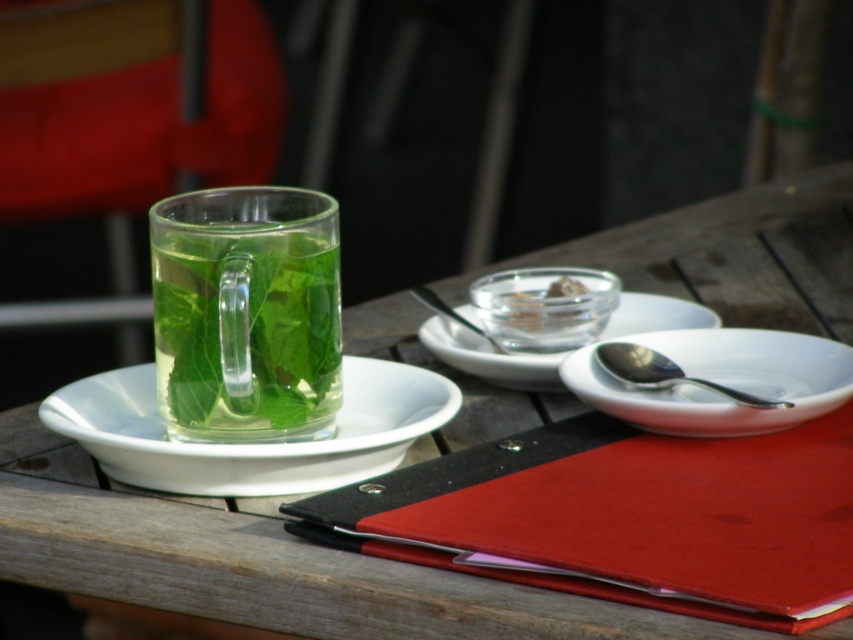
Question: Is transparent glass cup at upper left wider than silver metallic spoon at upper right?

Choices:
 (A) no
 (B) yes

Answer: (B)

Question: Which point is closer to the camera taking this photo?

Choices:
 (A) (x=560, y=246)
 (B) (x=581, y=284)

Answer: (B)

Question: Which of the following is the closest to the observer?

Choices:
 (A) (558, 372)
 (B) (822, 572)

Answer: (B)

Question: Is white ceramic plate at center below translucent glass bowl at center?

Choices:
 (A) yes
 (B) no

Answer: (A)

Question: Which of the following is the closest to the observer?

Choices:
 (A) (364, 612)
 (B) (648, 385)
 (C) (560, 365)
 (D) (434, 294)

Answer: (A)

Question: Does white ceramic plate at center lie behind satin silver spoon at upper center?

Choices:
 (A) yes
 (B) no

Answer: (B)